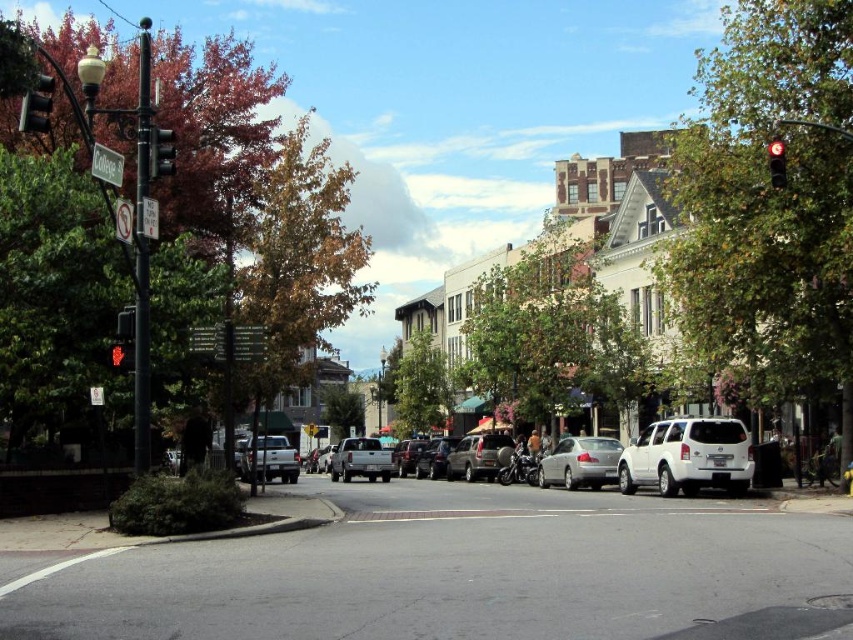
Can you confirm if metallic silver suv at center is positioned to the left of red matte traffic light at upper left?

In fact, metallic silver suv at center is to the right of red matte traffic light at upper left.

Can you confirm if metallic silver suv at center is shorter than red matte traffic light at upper left?

Incorrect, metallic silver suv at center's height does not fall short of red matte traffic light at upper left's.

Between point (469, 461) and point (120, 358), which one is positioned behind?

The point (469, 461) is behind.

This screenshot has width=853, height=640. In order to click on metallic silver suv at center in this screenshot , I will do point(479,456).

Is point (428, 467) farther from viewer compared to point (173, 161)?

Yes, it is.

Between point (415, 465) and point (151, 156), which one is positioned behind?

Point (415, 465)

Between point (440, 442) and point (149, 166), which one is positioned in front?

Point (149, 166)

Identify the location of matte gray suv at center. (434, 458).

Based on the photo, can you confirm if matte silver truck at center is wider than metallic silver traffic light at upper left?

Correct, the width of matte silver truck at center exceeds that of metallic silver traffic light at upper left.

Which of these two, matte silver truck at center or metallic silver traffic light at upper left, stands shorter?

metallic silver traffic light at upper left

Is point (248, 470) positioned in front of point (154, 150)?

No, (248, 470) is further to viewer.

This screenshot has height=640, width=853. What are the coordinates of `matte silver truck at center` in the screenshot? It's located at (267, 458).